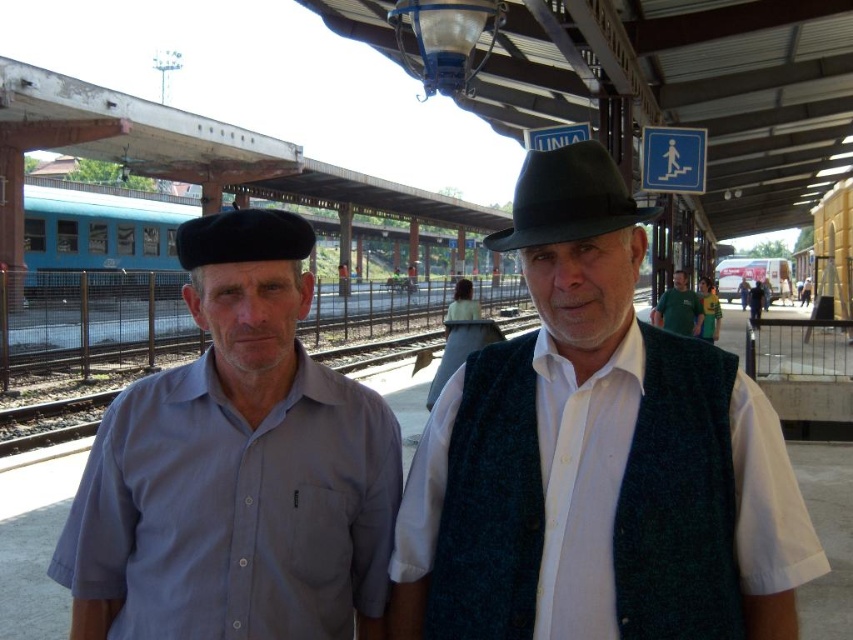
Question: Estimate the real-world distances between objects in this image. Which object is closer to the green fabric shirt at center?

Choices:
 (A) green knitted vest at center
 (B) black felt fedora at center

Answer: (B)

Question: Is light blue cotton shirt at left wider than black felt fedora at center?

Choices:
 (A) yes
 (B) no

Answer: (B)

Question: Which point appears closest to the camera in this image?

Choices:
 (A) (126, 262)
 (B) (773, 483)

Answer: (B)

Question: Among these objects, which one is farthest from the camera?

Choices:
 (A) green knitted vest at center
 (B) dark green woolen vest at center
 (C) green fabric shirt at center

Answer: (C)

Question: Does green knitted vest at center have a greater width compared to green fabric shirt at center?

Choices:
 (A) yes
 (B) no

Answer: (A)

Question: Can you confirm if dark green woolen vest at center is positioned to the left of black felt fedora at center?

Choices:
 (A) yes
 (B) no

Answer: (A)